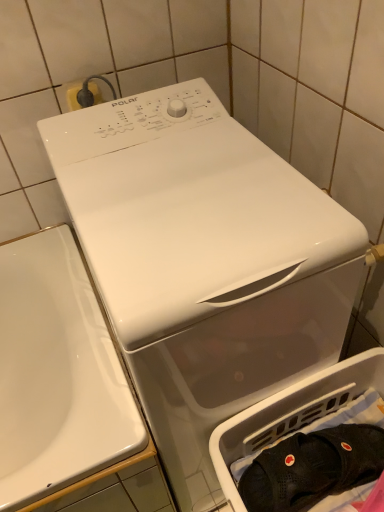
Question: Is black mesh bag at lower right in front of black mesh socks at lower right?

Choices:
 (A) yes
 (B) no

Answer: (A)

Question: Does black mesh bag at lower right turn towards black mesh socks at lower right?

Choices:
 (A) yes
 (B) no

Answer: (B)

Question: From the image's perspective, does black mesh bag at lower right appear higher than black mesh socks at lower right?

Choices:
 (A) no
 (B) yes

Answer: (A)

Question: Does black mesh bag at lower right have a greater width compared to black mesh socks at lower right?

Choices:
 (A) no
 (B) yes

Answer: (B)

Question: From a real-world perspective, is black mesh bag at lower right over black mesh socks at lower right?

Choices:
 (A) yes
 (B) no

Answer: (B)

Question: Do you think black mesh socks at lower right is within black mesh bag at lower right, or outside of it?

Choices:
 (A) inside
 (B) outside

Answer: (A)

Question: In terms of size, does black mesh socks at lower right appear bigger or smaller than black mesh bag at lower right?

Choices:
 (A) small
 (B) big

Answer: (A)

Question: Is black mesh socks at lower right wider or thinner than black mesh bag at lower right?

Choices:
 (A) thin
 (B) wide

Answer: (A)

Question: Would you say black mesh socks at lower right is to the left or to the right of black mesh bag at lower right in the picture?

Choices:
 (A) left
 (B) right

Answer: (A)

Question: Considering their positions, is black mesh bag at lower right located in front of or behind white glossy washing machine at center?

Choices:
 (A) behind
 (B) front

Answer: (A)

Question: Is point (278, 413) positioned closer to the camera than point (266, 161)?

Choices:
 (A) closer
 (B) farther

Answer: (B)

Question: Considering the positions of black mesh bag at lower right and white glossy washing machine at center in the image, is black mesh bag at lower right taller or shorter than white glossy washing machine at center?

Choices:
 (A) short
 (B) tall

Answer: (A)

Question: From a real-world perspective, relative to white glossy washing machine at center, is black mesh bag at lower right vertically above or below?

Choices:
 (A) below
 (B) above

Answer: (A)

Question: Looking at their shapes, would you say white glossy washing machine at center is wider or thinner than black mesh bag at lower right?

Choices:
 (A) thin
 (B) wide

Answer: (B)

Question: From the image's perspective, relative to black mesh bag at lower right, is white glossy washing machine at center above or below?

Choices:
 (A) above
 (B) below

Answer: (A)